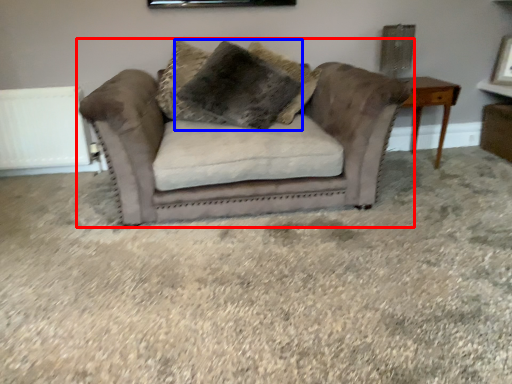
Question: Which of the following is the closest to the observer, studio couch (highlighted by a red box) or pillow (highlighted by a blue box)?

Choices:
 (A) studio couch
 (B) pillow

Answer: (A)